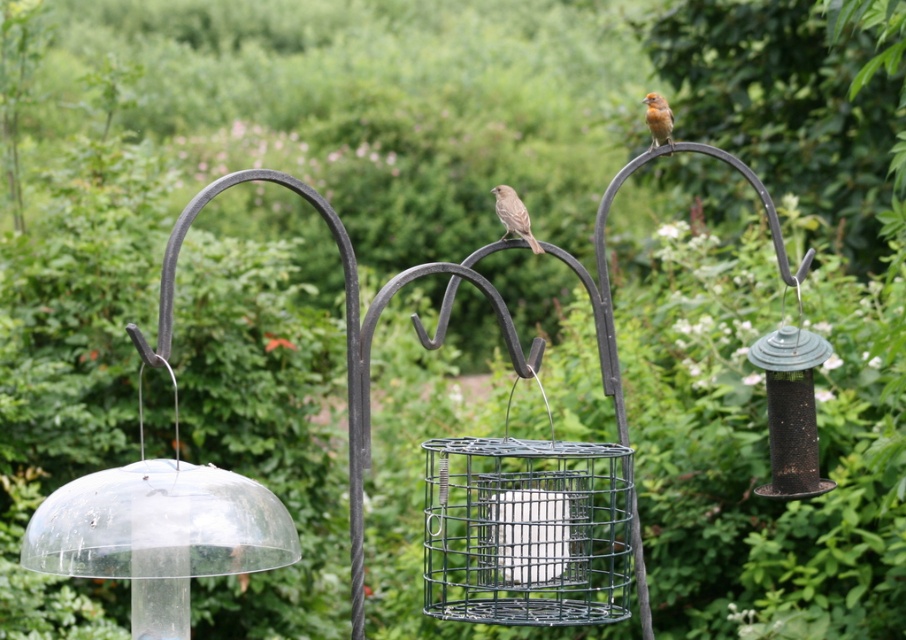
You are a birder observing the bird feeder. You notice a brown feathered bird at center and a brown speckled feathers at upper right. Which one is bigger?

The brown feathered bird at center is larger in size than the brown speckled feathers at upper right.

You are a bird with a wingspan of 50 centimeters. You are currently perched on the brown speckled feathers at upper right and want to reach the wire mesh bird feeder at center. Can you fly directly to the feeder without flapping your wings?

The distance between the wire mesh bird feeder at center and the brown speckled feathers at upper right is 69.18 centimeters. Since your wingspan is 50 centimeters, you cannot cover the distance in one glide without flapping your wings. You will need to flap your wings to reach the feeder.

What are the coordinates of the wire mesh bird feeder at center?

The wire mesh bird feeder at center is located at coordinates point (x=526, y=529).